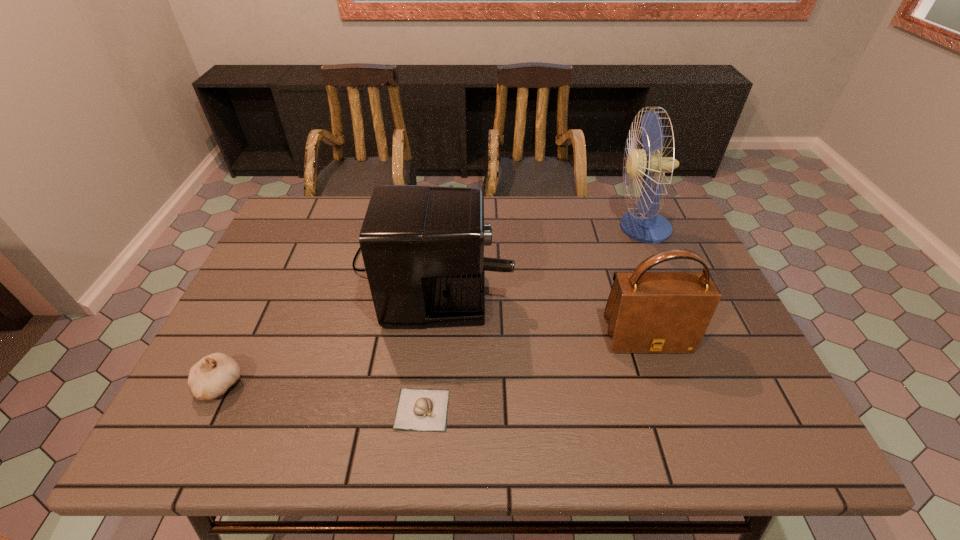
Where is `blank area in the image that satisfies the following two spatial constraints: 1. at the front of the fan where the blades are visible; 2. on the front side of the shorter garlic`? The width and height of the screenshot is (960, 540). blank area in the image that satisfies the following two spatial constraints: 1. at the front of the fan where the blades are visible; 2. on the front side of the shorter garlic is located at coordinates (719, 409).